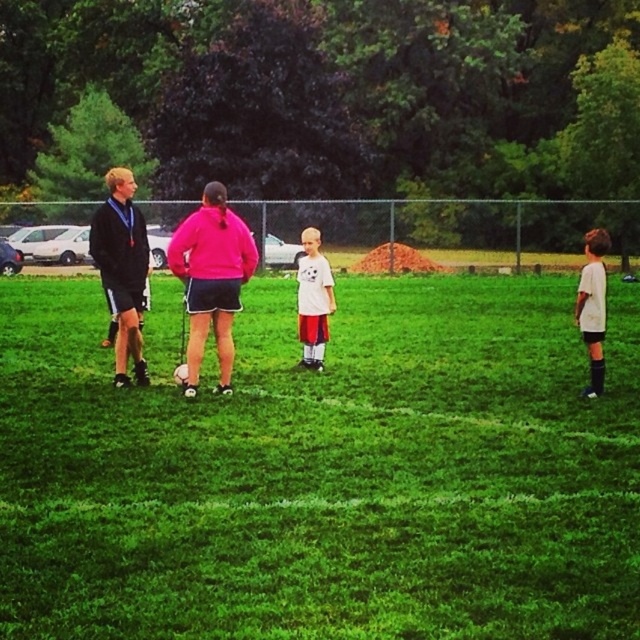
Which is above, green grass at center or matte black jacket at left?

Positioned higher is matte black jacket at left.

Who is more forward, (252, 320) or (132, 282)?

Point (132, 282)

You are a GUI agent. You are given a task and a screenshot of the screen. Output one action in this format:
    pyautogui.click(x=<x>, y=<y>)
    Task: Click on the green grass at center
    
    Given the screenshot: What is the action you would take?
    pyautogui.click(x=323, y=468)

Is pink matte shorts at center behind white matte shirt at right?

That is False.

Is pink matte shorts at center positioned in front of white matte shirt at right?

That is True.

Is point (228, 273) farther from camera compared to point (595, 268)?

That is True.

Find the location of `pink matte shorts at center`. pink matte shorts at center is located at coordinates (211, 278).

Which of these two, pink matte shorts at center or matte black jacket at left, stands taller?

Standing taller between the two is matte black jacket at left.

The height and width of the screenshot is (640, 640). Identify the location of pink matte shorts at center. (211, 278).